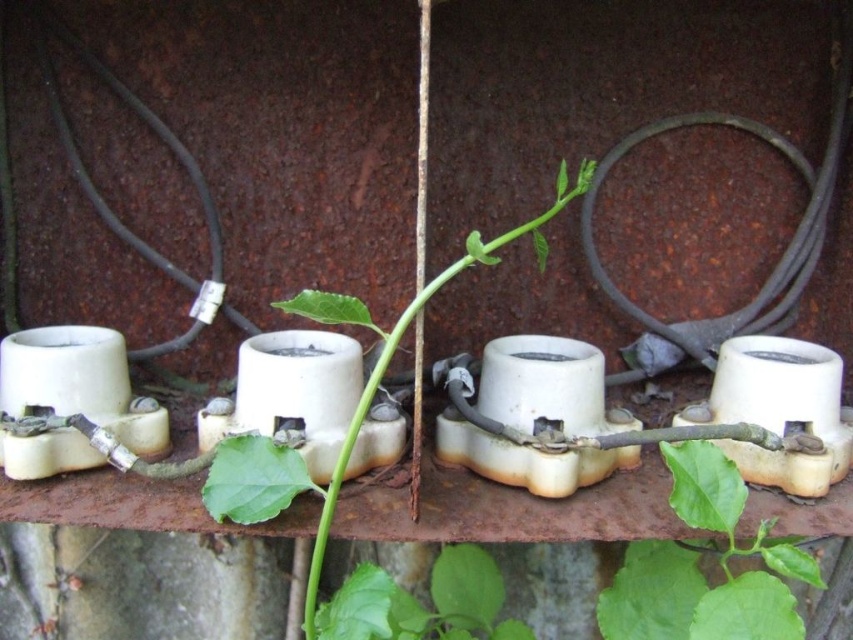
Question: Does green matte leaf at center have a smaller size compared to green leafy plant at center?

Choices:
 (A) no
 (B) yes

Answer: (A)

Question: Which point appears farthest from the camera in this image?

Choices:
 (A) (787, 636)
 (B) (445, 586)

Answer: (B)

Question: Does green matte leaf at center appear under green leafy plant at center?

Choices:
 (A) yes
 (B) no

Answer: (B)

Question: Which of the following is the closest to the observer?

Choices:
 (A) pyautogui.click(x=457, y=611)
 (B) pyautogui.click(x=758, y=531)

Answer: (B)

Question: Among these objects, which one is farthest from the camera?

Choices:
 (A) green matte leaf at center
 (B) green leafy plant at center

Answer: (B)

Question: Does green matte leaf at center have a lesser width compared to green leafy plant at center?

Choices:
 (A) no
 (B) yes

Answer: (B)